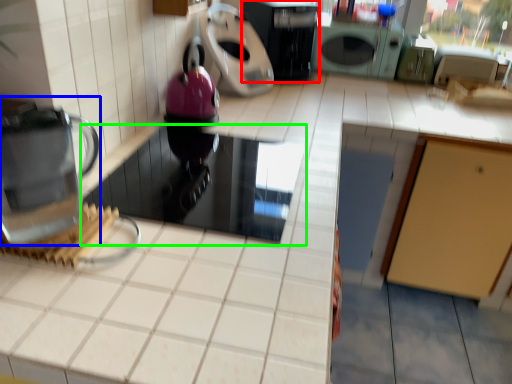
Question: Which object is the closest to the kitchen appliance (highlighted by a red box)? Choose among these: home appliance (highlighted by a blue box) or appliance (highlighted by a green box).

Choices:
 (A) home appliance
 (B) appliance

Answer: (B)